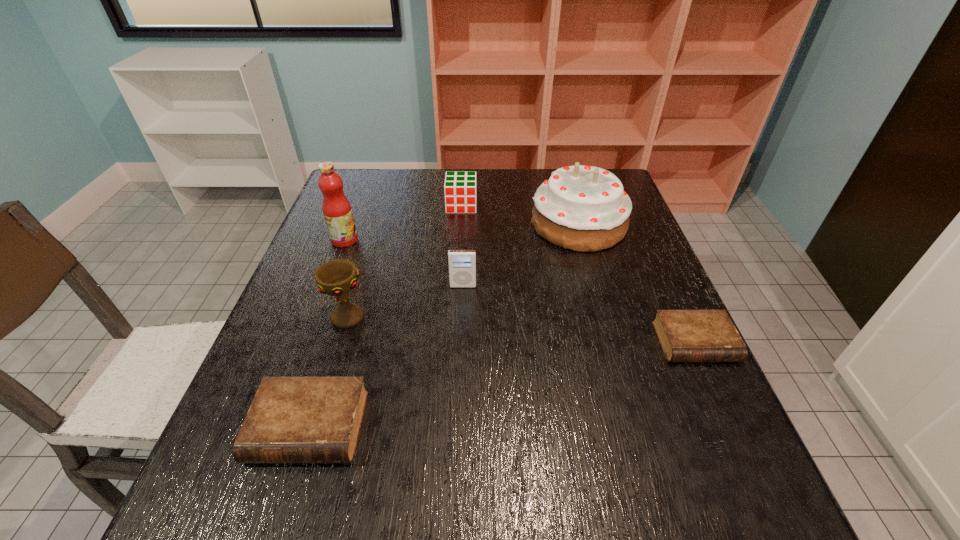
The height and width of the screenshot is (540, 960). I want to click on free space located 0.150m on the spine side of the shortest object, so click(x=737, y=434).

The width and height of the screenshot is (960, 540). I want to click on free space located on the red face of the cube, so click(456, 293).

What are the coordinates of `vacant space located 0.370m on the front label of the tallest object` in the screenshot? It's located at pyautogui.click(x=492, y=240).

The height and width of the screenshot is (540, 960). In order to click on vacant space situated on the left of the cake in this screenshot , I will do `click(465, 224)`.

You are a GUI agent. You are given a task and a screenshot of the screen. Output one action in this format:
    pyautogui.click(x=<x>, y=<y>)
    Task: Click on the blank space located on the front of the chalice
    
    Given the screenshot: What is the action you would take?
    (x=338, y=350)

What are the coordinates of `vacant space located on the front-facing side of the iPod` in the screenshot? It's located at (457, 434).

The image size is (960, 540). Find the location of `cube positioned at the far edge`. cube positioned at the far edge is located at coordinates (460, 187).

This screenshot has width=960, height=540. What are the coordinates of `cake located in the far edge section of the desktop` in the screenshot? It's located at (581, 208).

Image resolution: width=960 pixels, height=540 pixels. I want to click on object that is at the near edge, so click(291, 419).

At what (x,y) coordinates should I click in order to perform the action: click on diary located at the left edge. Please return your answer as a coordinate pair (x, y). The height and width of the screenshot is (540, 960). Looking at the image, I should click on (291, 419).